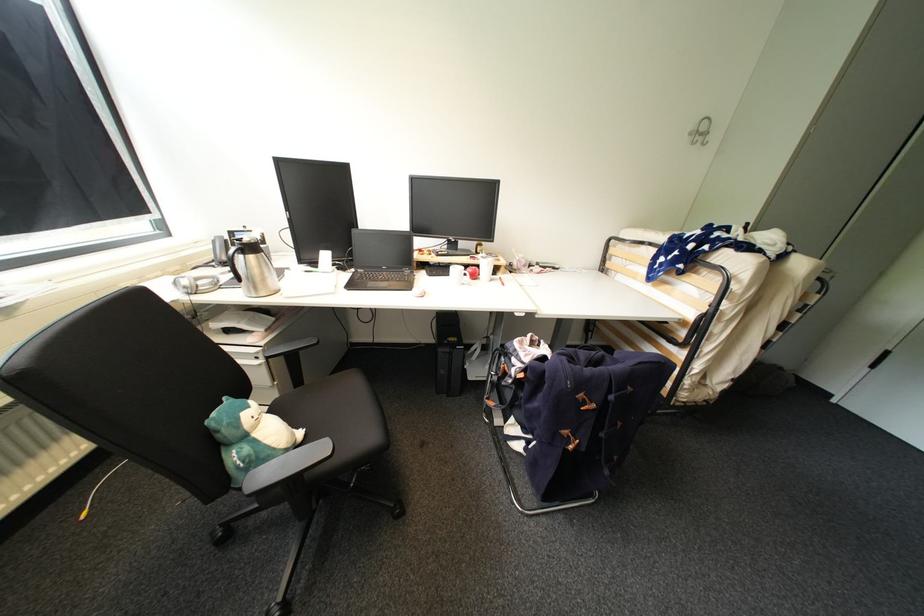
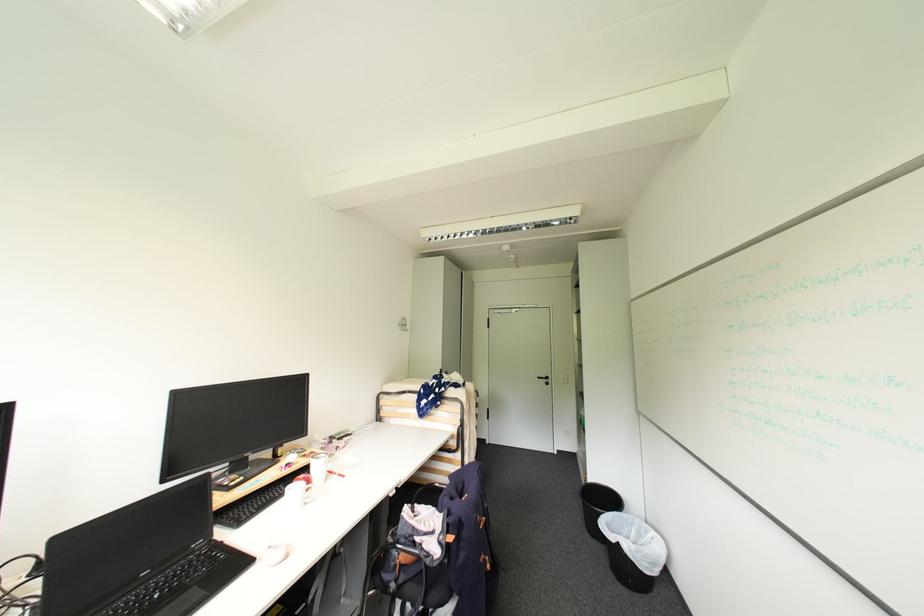
Where in the second image is the point corresponding to point 390,268 from the first image?

(150, 575)